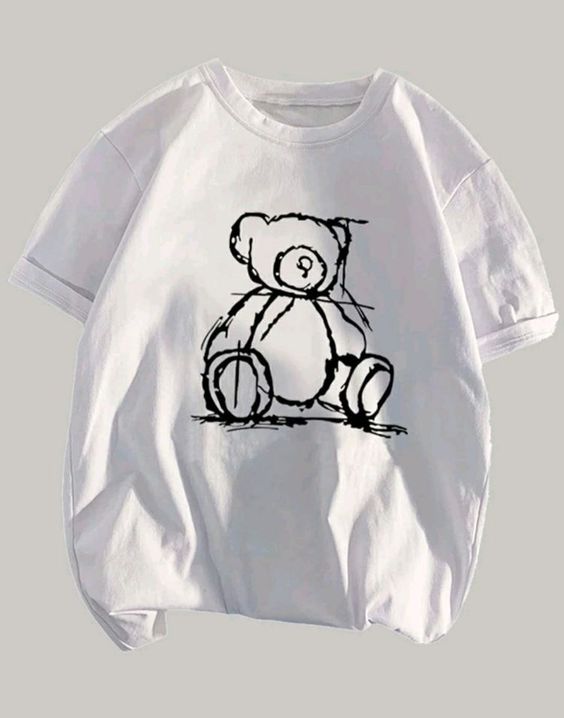
Locate an element on the screen. Image resolution: width=564 pixels, height=718 pixels. surface on which teddy bear sits is located at coordinates (270, 424), (334, 424).